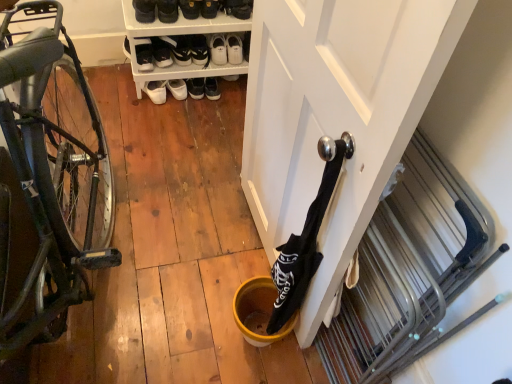
Question: Can you confirm if black fabric wine bottle at center is shorter than white leather shoe at upper center, the second shoe when ordered from left to right?

Choices:
 (A) no
 (B) yes

Answer: (A)

Question: Does black fabric wine bottle at center have a larger size compared to white leather shoe at upper center, positioned as the 1th shoe in right-to-left order?

Choices:
 (A) no
 (B) yes

Answer: (B)

Question: Is black fabric wine bottle at center thinner than white leather shoe at upper center, the second shoe when ordered from left to right?

Choices:
 (A) yes
 (B) no

Answer: (A)

Question: Does black fabric wine bottle at center have a greater height compared to white leather shoe at upper center, positioned as the 1th shoe in right-to-left order?

Choices:
 (A) no
 (B) yes

Answer: (B)

Question: From the image's perspective, is black fabric wine bottle at center over white leather shoe at upper center, the second shoe when ordered from left to right?

Choices:
 (A) yes
 (B) no

Answer: (B)

Question: Does point (137, 6) appear closer or farther from the camera than point (204, 3)?

Choices:
 (A) farther
 (B) closer

Answer: (A)

Question: Considering their positions, is black suede shoes at upper center, the 5th footwear from the right, located in front of or behind white leather shoe at upper center, the second shoe when ordered from left to right?

Choices:
 (A) behind
 (B) front

Answer: (B)

Question: Which is correct: black suede shoes at upper center, the second footwear in the left-to-right sequence, is inside white leather shoe at upper center, the second shoe when ordered from left to right, or outside of it?

Choices:
 (A) outside
 (B) inside

Answer: (A)

Question: From the image's perspective, is black suede shoes at upper center, the second footwear in the left-to-right sequence, positioned above or below white leather shoe at upper center, positioned as the 1th shoe in right-to-left order?

Choices:
 (A) below
 (B) above

Answer: (A)

Question: Is white leather sneakers at upper center, arranged as the first footwear when viewed from the right, bigger or smaller than black suede shoes at upper center, the 5th footwear from the right?

Choices:
 (A) small
 (B) big

Answer: (A)

Question: In terms of height, does white leather sneakers at upper center, arranged as the sixth footwear when viewed from the left, look taller or shorter compared to black suede shoes at upper center, the 5th footwear from the right?

Choices:
 (A) tall
 (B) short

Answer: (B)

Question: Is white leather sneakers at upper center, arranged as the first footwear when viewed from the right, in front of or behind black suede shoes at upper center, the 5th footwear from the right, in the image?

Choices:
 (A) front
 (B) behind

Answer: (B)

Question: Which is correct: white leather sneakers at upper center, arranged as the sixth footwear when viewed from the left, is inside black suede shoes at upper center, the 5th footwear from the right, or outside of it?

Choices:
 (A) inside
 (B) outside

Answer: (B)

Question: Considering the positions of yellow matte bucket at lower center and shiny black bicycle at left in the image, is yellow matte bucket at lower center wider or thinner than shiny black bicycle at left?

Choices:
 (A) thin
 (B) wide

Answer: (A)

Question: In terms of size, does yellow matte bucket at lower center appear bigger or smaller than shiny black bicycle at left?

Choices:
 (A) big
 (B) small

Answer: (B)